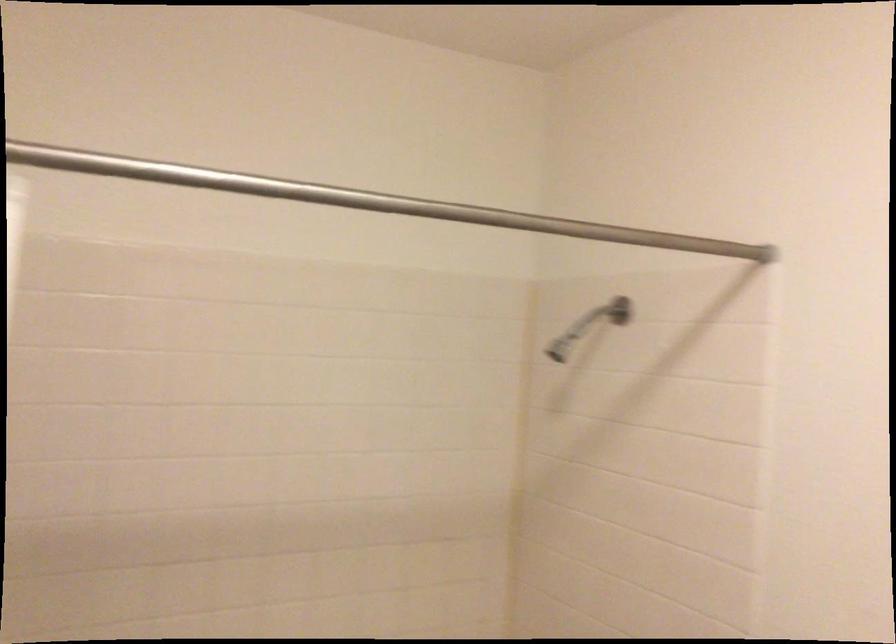
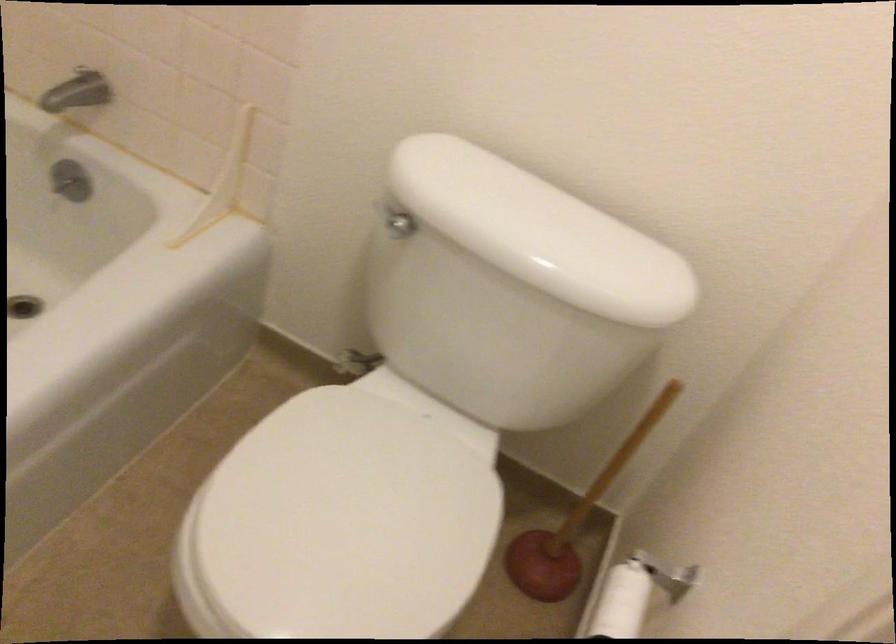
How did the camera likely rotate?

The rotation direction of the camera is right-down.